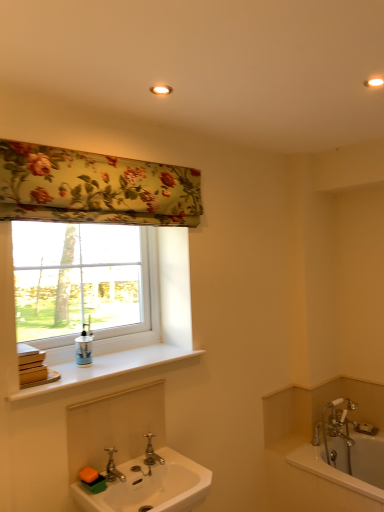
At what (x,y) coordinates should I click in order to perform the action: click on free location in front of matte white recessed light at upper center. Please return your answer as a coordinate pair (x, y). The width and height of the screenshot is (384, 512). Looking at the image, I should click on (154, 72).